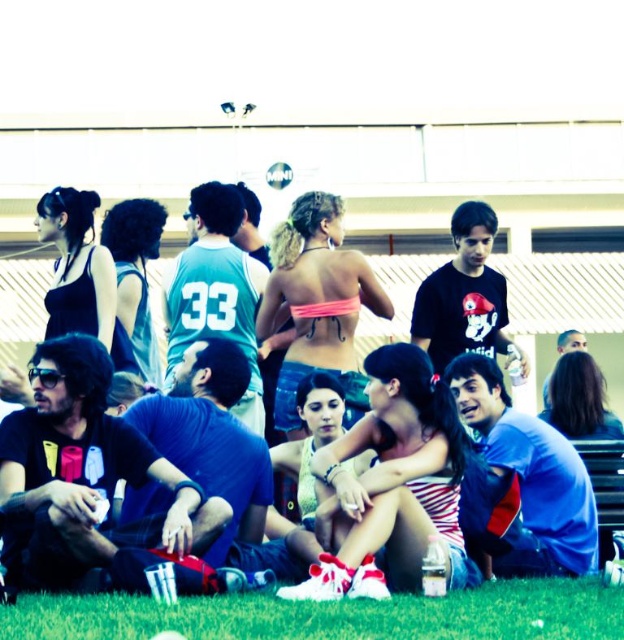
Between point (318, 627) and point (74, 269), which one is positioned behind?

The point (74, 269) is more distant.

Does point (452, 636) come farther from viewer compared to point (80, 250)?

No, it is not.

Find the location of a particular element. The image size is (624, 640). green grass at lower center is located at coordinates (333, 614).